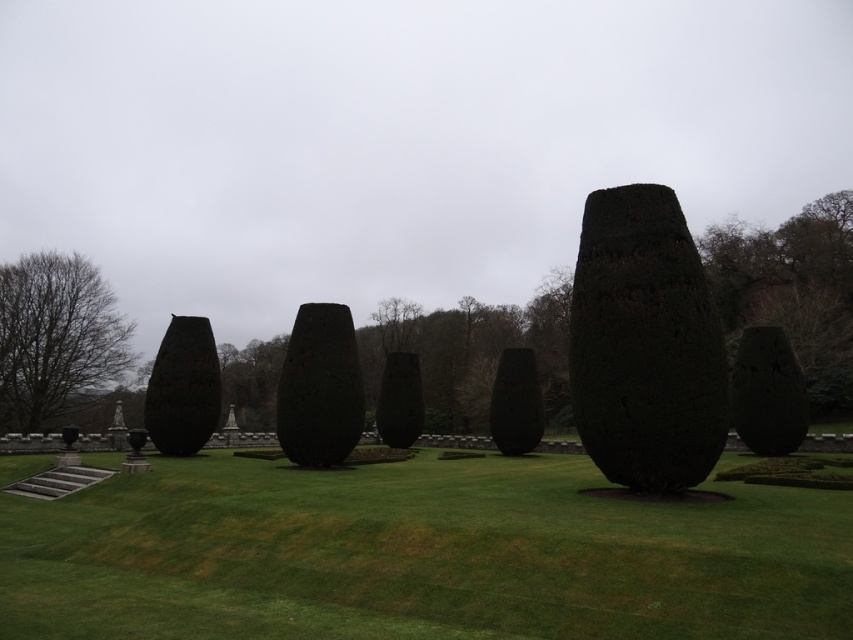
Question: Among these objects, which one is farthest from the camera?

Choices:
 (A) dark green textured cone at center
 (B) green grass at center
 (C) dark brown textured vase at left

Answer: (C)

Question: Considering the relative positions of green grass at center and dark brown textured vase at left in the image provided, where is green grass at center located with respect to dark brown textured vase at left?

Choices:
 (A) right
 (B) left

Answer: (A)

Question: Which point is closer to the camera?

Choices:
 (A) dark brown bark tree at left
 (B) dark green textured cone at center
 (C) dark green stone vase at center

Answer: (B)

Question: Is green grass at center bigger than dark brown stone vase at center?

Choices:
 (A) no
 (B) yes

Answer: (B)

Question: Which point is farther to the camera?

Choices:
 (A) dark brown textured vase at left
 (B) dark green textured cone at center
 (C) dark brown stone vase at center

Answer: (C)

Question: Where is green grass at center located in relation to dark brown textured vase at left in the image?

Choices:
 (A) right
 (B) left

Answer: (A)